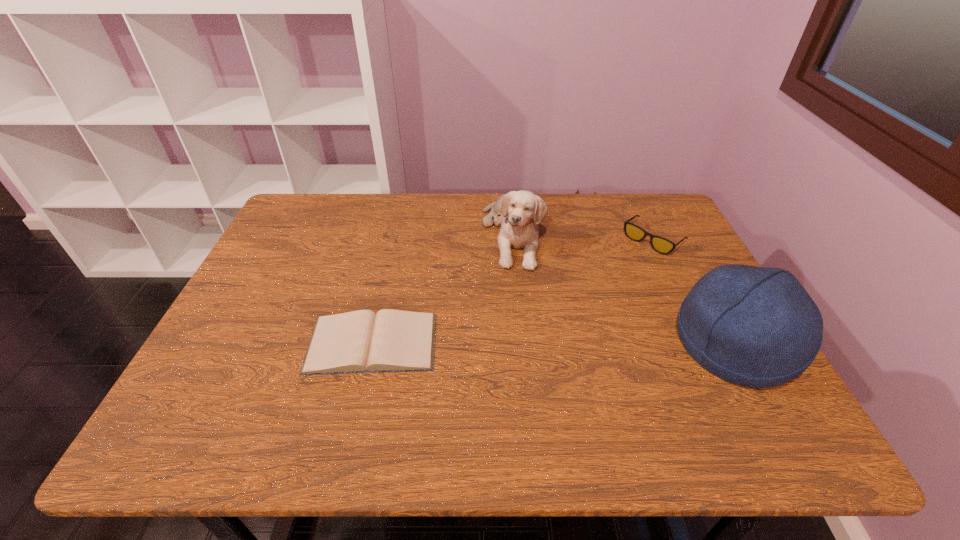
This screenshot has width=960, height=540. I want to click on the shortest object, so click(362, 341).

Locate an element on the screen. This screenshot has width=960, height=540. the leftmost object is located at coordinates (362, 341).

Locate an element on the screen. This screenshot has height=540, width=960. skullcap is located at coordinates (757, 327).

Locate an element on the screen. The image size is (960, 540). the third shortest object is located at coordinates (520, 212).

Image resolution: width=960 pixels, height=540 pixels. What are the coordinates of `the third object from right to left` in the screenshot? It's located at (520, 212).

At what (x,y) coordinates should I click in order to perform the action: click on the third tallest object. Please return your answer as a coordinate pair (x, y). The image size is (960, 540). Looking at the image, I should click on (661, 245).

In order to click on vacant space located 0.150m on the right of the leftmost object in this screenshot , I will do `click(500, 342)`.

Locate an element on the screen. vacant space located on the back of the tallest object is located at coordinates point(684,253).

Find the location of a particular element. free space located 0.280m on the front-facing side of the third shortest object is located at coordinates (546, 350).

Identify the location of vacant space located 0.370m on the front-facing side of the third shortest object. (558, 383).